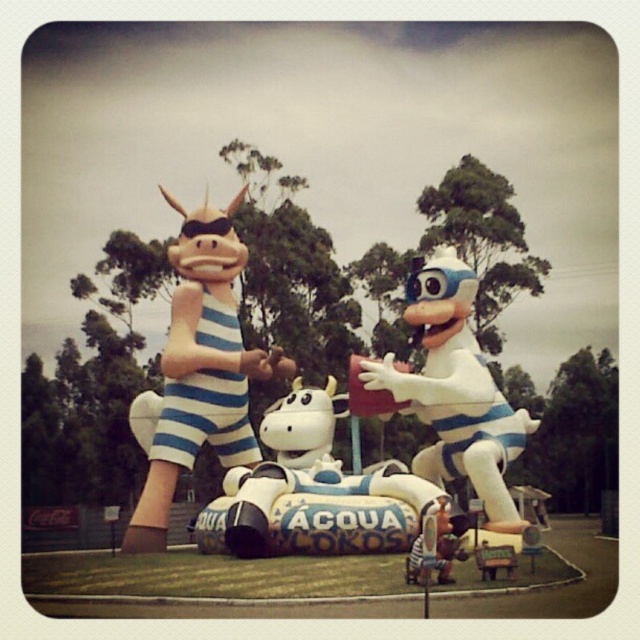
Consider the image. Is white rubber car at center positioned behind white glossy toy at center?

No, it is not.

Identify the location of white rubber car at center. (312, 492).

Which is more to the left, matte plastic pig at center or white glossy toy at center?

From the viewer's perspective, matte plastic pig at center appears more on the left side.

Does matte plastic pig at center have a lesser height compared to white glossy toy at center?

Incorrect, matte plastic pig at center's height does not fall short of white glossy toy at center's.

Where is `matte plastic pig at center`? The height and width of the screenshot is (640, 640). matte plastic pig at center is located at coordinates (202, 369).

Who is lower down, matte plastic pig at center or white rubber car at center?

white rubber car at center is below.

Which is more to the left, matte plastic pig at center or white rubber car at center?

From the viewer's perspective, matte plastic pig at center appears more on the left side.

The image size is (640, 640). What do you see at coordinates (202, 369) in the screenshot?
I see `matte plastic pig at center` at bounding box center [202, 369].

In order to click on matte plastic pig at center in this screenshot , I will do `click(202, 369)`.